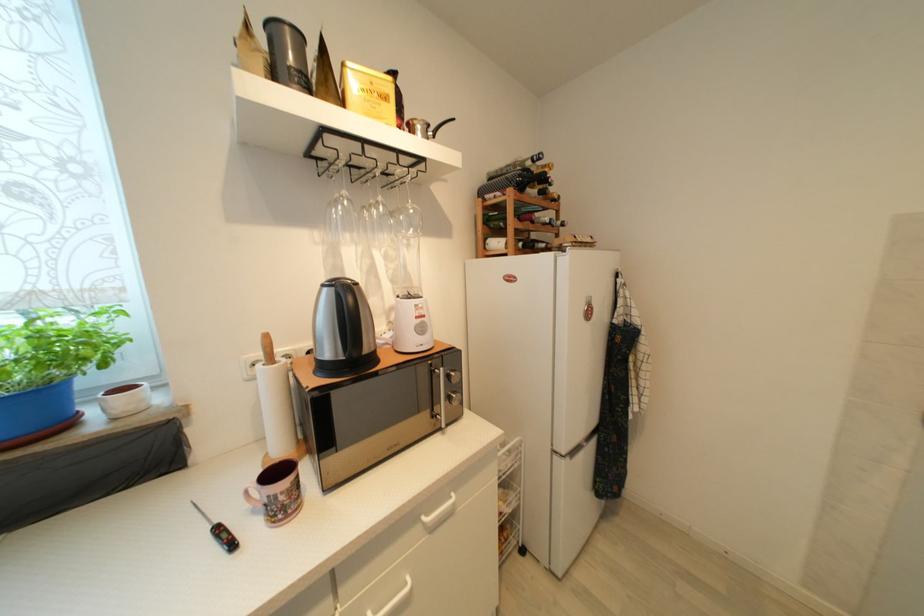
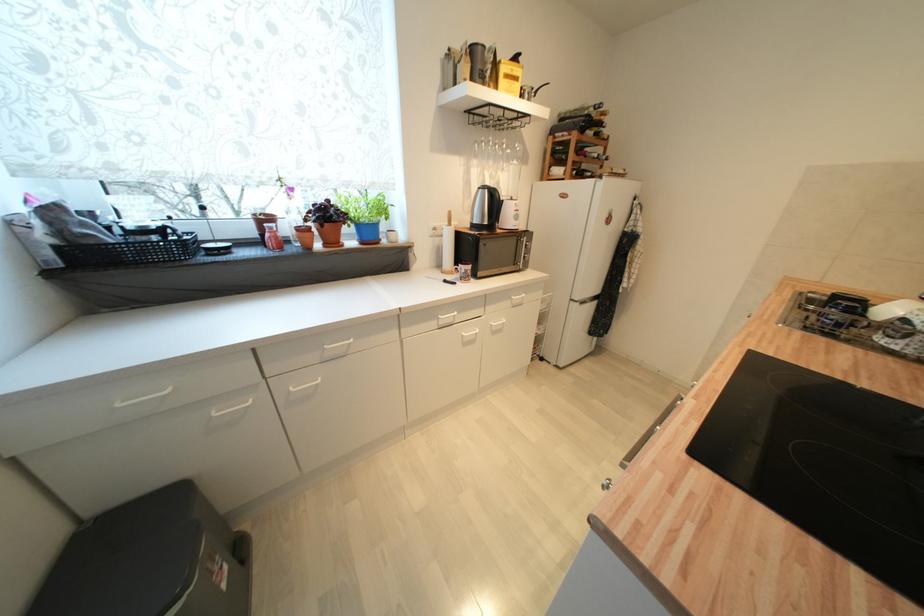
The point at (383, 206) is marked in the first image. Where is the corresponding point in the second image?

(507, 146)